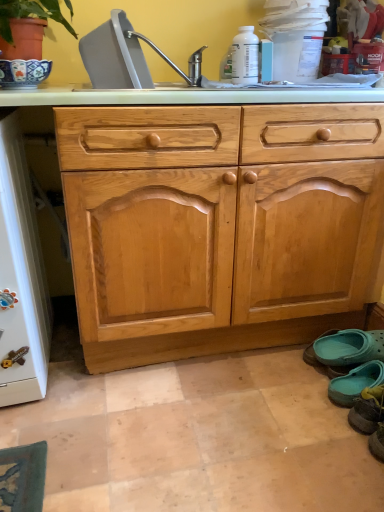
Question: Is teal fabric slipper at lower right, the 3th footwear from the back, not within teal fabric slipper at lower right, which is counted as the second footwear, starting from the back?

Choices:
 (A) yes
 (B) no

Answer: (A)

Question: From a real-world perspective, is teal fabric slipper at lower right, the 3th footwear from the back, physically below teal fabric slipper at lower right, which is counted as the second footwear, starting from the back?

Choices:
 (A) no
 (B) yes

Answer: (A)

Question: Does teal fabric slipper at lower right, arranged as the first footwear when viewed from the front, have a smaller size compared to teal fabric slipper at lower right, which is counted as the second footwear, starting from the back?

Choices:
 (A) no
 (B) yes

Answer: (A)

Question: From the image's perspective, is teal fabric slipper at lower right, arranged as the first footwear when viewed from the front, beneath teal fabric slipper at lower right, the second footwear when ordered from front to back?

Choices:
 (A) no
 (B) yes

Answer: (B)

Question: Can you confirm if teal fabric slipper at lower right, the 3th footwear from the back, is positioned to the left of teal fabric slipper at lower right, which is counted as the second footwear, starting from the back?

Choices:
 (A) yes
 (B) no

Answer: (B)

Question: In terms of height, does silver metallic faucet at upper center, the 2th sink from the front, look taller or shorter compared to light brown wood drawer at center?

Choices:
 (A) tall
 (B) short

Answer: (A)

Question: Considering the positions of silver metallic faucet at upper center, the 2th sink from the front, and light brown wood drawer at center in the image, is silver metallic faucet at upper center, the 2th sink from the front, bigger or smaller than light brown wood drawer at center?

Choices:
 (A) small
 (B) big

Answer: (A)

Question: From a real-world perspective, relative to light brown wood drawer at center, is silver metallic faucet at upper center, the 2th sink from the front, vertically above or below?

Choices:
 (A) below
 (B) above

Answer: (B)

Question: Is silver metallic faucet at upper center, the 2th sink from the front, situated inside light brown wood drawer at center or outside?

Choices:
 (A) outside
 (B) inside

Answer: (B)

Question: From a real-world perspective, is light brown wood drawer at center physically located above or below silver metallic faucet at upper center, the 2th sink from the front?

Choices:
 (A) below
 (B) above

Answer: (A)

Question: Is light brown wood drawer at center taller or shorter than silver metallic faucet at upper center, acting as the first sink starting from the back?

Choices:
 (A) short
 (B) tall

Answer: (A)

Question: Based on their sizes in the image, would you say light brown wood drawer at center is bigger or smaller than silver metallic faucet at upper center, the 2th sink from the front?

Choices:
 (A) big
 (B) small

Answer: (A)

Question: Looking at their shapes, would you say light brown wood drawer at center is wider or thinner than silver metallic faucet at upper center, acting as the first sink starting from the back?

Choices:
 (A) wide
 (B) thin

Answer: (A)

Question: From a real-world perspective, is gray plastic sink at upper center, which ranks as the first sink in front-to-back order, above or below teal rubber clogs at lower right, the third footwear from the front?

Choices:
 (A) above
 (B) below

Answer: (A)

Question: From the image's perspective, is gray plastic sink at upper center, placed as the 2th sink when sorted from back to front, positioned above or below teal rubber clogs at lower right, the third footwear from the front?

Choices:
 (A) below
 (B) above

Answer: (B)